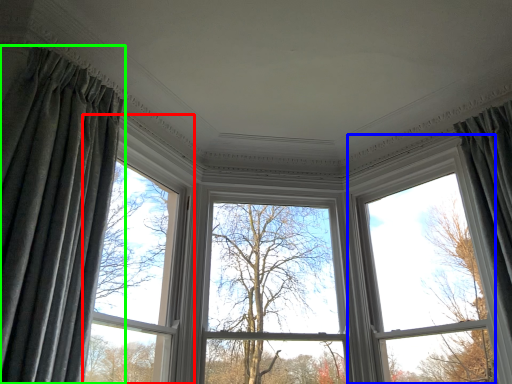
Question: Which is nearer to the window (highlighted by a red box)? bay window (highlighted by a blue box) or curtain (highlighted by a green box).

Choices:
 (A) bay window
 (B) curtain

Answer: (B)